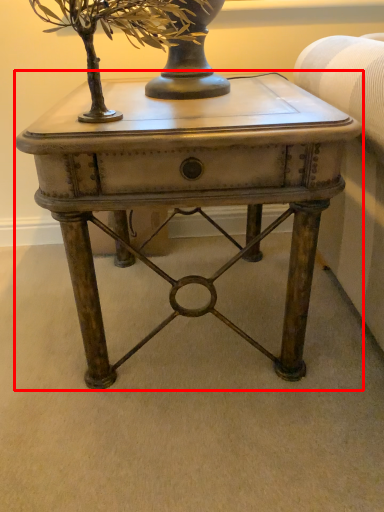
Question: In this image, where is table (annotated by the red box) located relative to tree?

Choices:
 (A) left
 (B) right

Answer: (B)